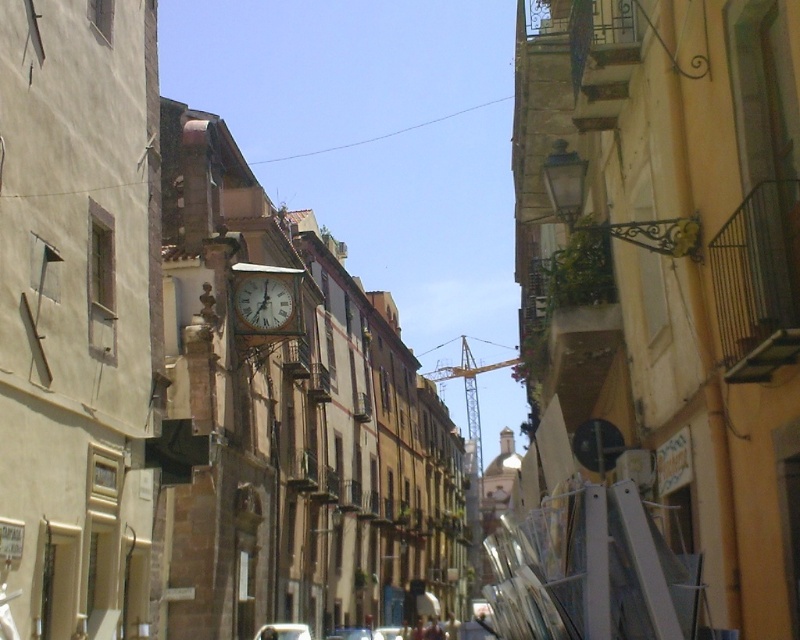
Between wooden clock at center and metallic silver car at lower center, which one is positioned lower?

Positioned lower is metallic silver car at lower center.

Is wooden clock at center thinner than metallic silver car at lower center?

Correct, wooden clock at center's width is less than metallic silver car at lower center's.

Does point (296, 332) come behind point (258, 637)?

Yes, it is behind point (258, 637).

In order to click on wooden clock at center in this screenshot , I will do `click(266, 300)`.

At what (x,y) coordinates should I click in order to perform the action: click on wooden clock at center. Please return your answer as a coordinate pair (x, y). Image resolution: width=800 pixels, height=640 pixels. Looking at the image, I should click on (266, 300).

How much distance is there between wooden clock at center and metallic silver car at center?

They are 41.96 meters apart.

Locate an element on the screen. The image size is (800, 640). wooden clock at center is located at coordinates (266, 300).

Image resolution: width=800 pixels, height=640 pixels. What are the coordinates of `wooden clock at center` in the screenshot? It's located at (266, 300).

Can you confirm if wooden clock at center is positioned below white matte car at center?

No.

Can you confirm if wooden clock at center is thinner than white matte car at center?

Indeed, wooden clock at center has a lesser width compared to white matte car at center.

Measure the distance between point (234, 301) and camera.

Point (234, 301) and camera are 222.90 feet apart.

At what (x,y) coordinates should I click in order to perform the action: click on wooden clock at center. Please return your answer as a coordinate pair (x, y). Looking at the image, I should click on (266, 300).